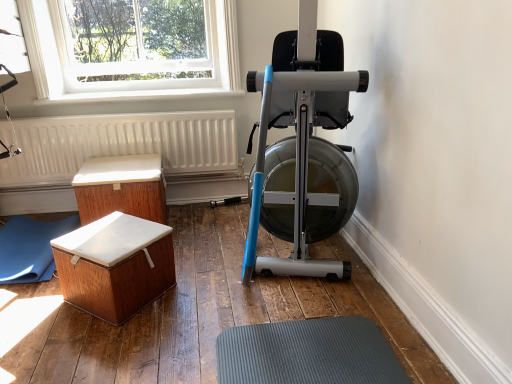
Question: Does silver metallic stationary bicycle at center have a greater height compared to white textured radiator at lower left?

Choices:
 (A) no
 (B) yes

Answer: (B)

Question: From the image's perspective, is silver metallic stationary bicycle at center below white textured radiator at lower left?

Choices:
 (A) no
 (B) yes

Answer: (A)

Question: Is there a large distance between silver metallic stationary bicycle at center and white textured radiator at lower left?

Choices:
 (A) no
 (B) yes

Answer: (B)

Question: Is silver metallic stationary bicycle at center oriented towards white textured radiator at lower left?

Choices:
 (A) yes
 (B) no

Answer: (B)

Question: Is silver metallic stationary bicycle at center placed right next to white textured radiator at lower left?

Choices:
 (A) yes
 (B) no

Answer: (B)

Question: Is white textured radiator at lower left a part of silver metallic stationary bicycle at center?

Choices:
 (A) no
 (B) yes

Answer: (A)

Question: Is clear glass window at upper left surrounding silver metallic stationary bicycle at center?

Choices:
 (A) no
 (B) yes

Answer: (A)

Question: Does clear glass window at upper left come behind silver metallic stationary bicycle at center?

Choices:
 (A) yes
 (B) no

Answer: (A)

Question: Does clear glass window at upper left have a greater height compared to silver metallic stationary bicycle at center?

Choices:
 (A) no
 (B) yes

Answer: (A)

Question: Does clear glass window at upper left have a lesser height compared to silver metallic stationary bicycle at center?

Choices:
 (A) no
 (B) yes

Answer: (B)

Question: Does clear glass window at upper left appear on the left side of silver metallic stationary bicycle at center?

Choices:
 (A) no
 (B) yes

Answer: (B)

Question: From a real-world perspective, is clear glass window at upper left positioned over silver metallic stationary bicycle at center based on gravity?

Choices:
 (A) yes
 (B) no

Answer: (A)

Question: Is wooden chest at lower left, which ranks as the 1th furniture in front-to-back order, not close to silver metallic stationary bicycle at center?

Choices:
 (A) no
 (B) yes

Answer: (A)